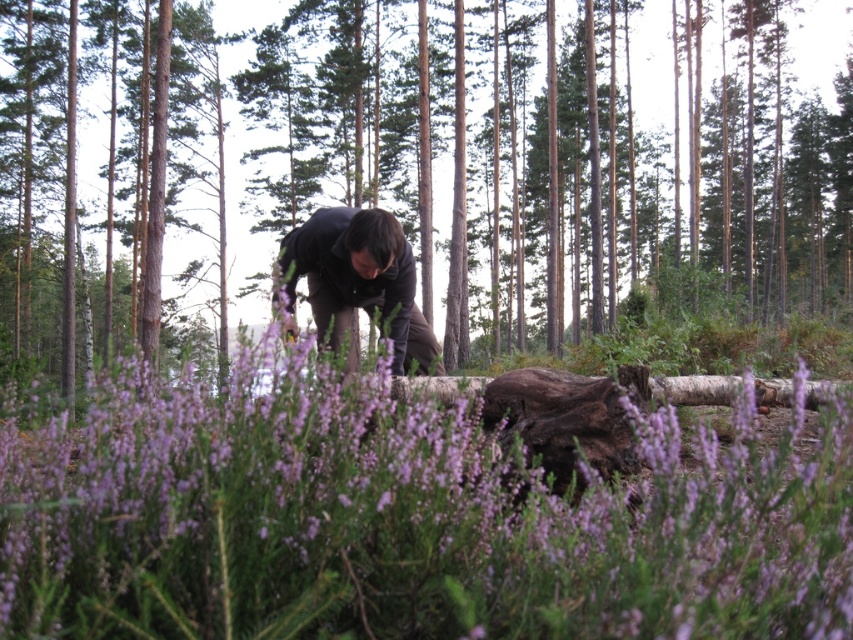
You are a photographer standing in the forest scene, and you want to take a closeup shot of the brown rough log at center. The camera you have can focus on objects within 5 feet. Can you take the photo without moving closer?

The brown rough log at center is 5.74 feet from camera, which is beyond the camera focus range of 5 feet. You need to move closer to take the photo.